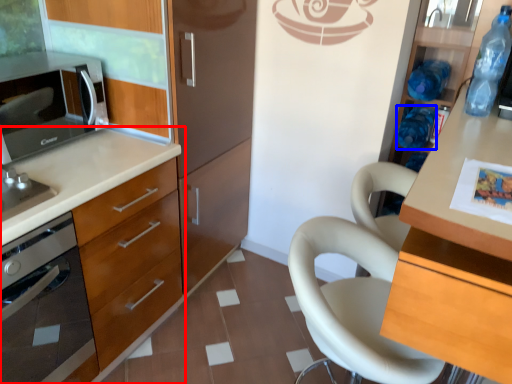
Question: Which point is closer to the camera, cabinetry (highlighted by a red box) or bottle (highlighted by a blue box)?

Choices:
 (A) cabinetry
 (B) bottle

Answer: (A)